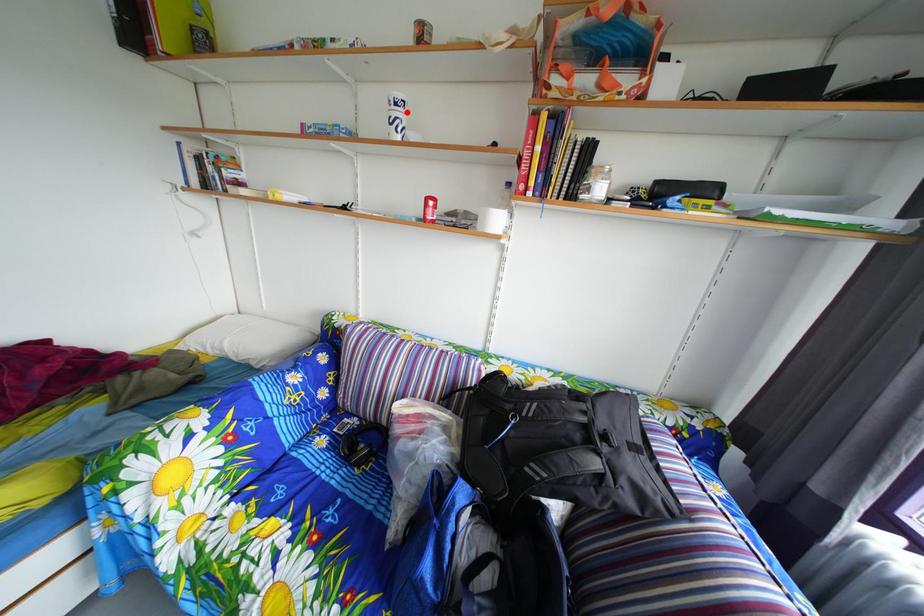
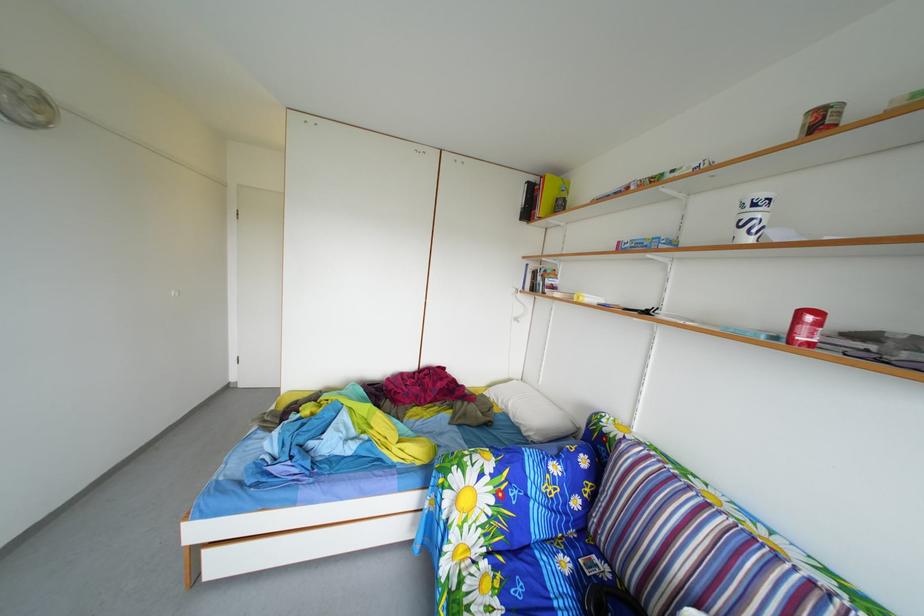
Find the pixel in the second image that matches the highlighted location in the first image.

(766, 214)